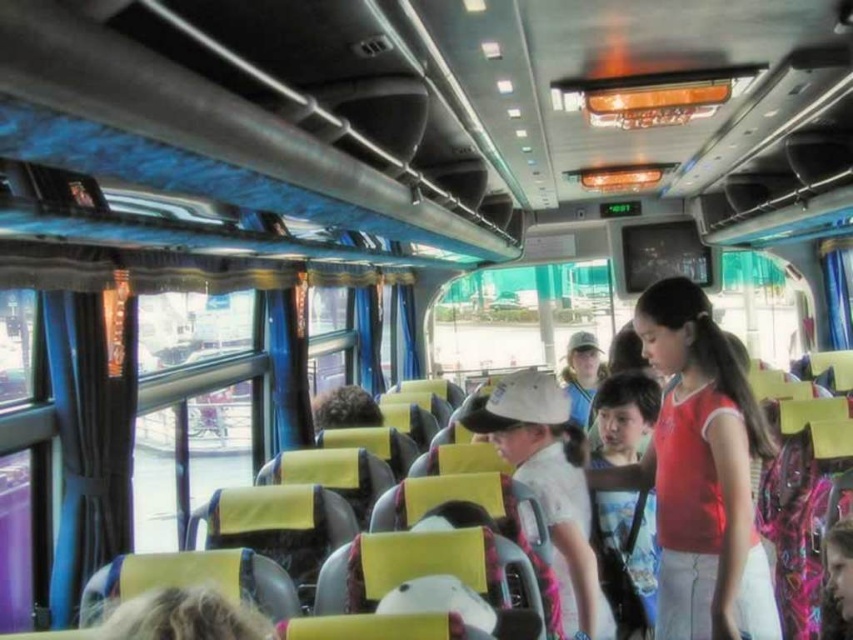
You are a bus passenger who wants to place both the white matte hat at center and the matte white cap at center into a small bag. Which item will fit better in the bag?

The white matte hat at center has a lesser width compared to the matte white cap at center, so it will fit better in the small bag.

You are a parent trying to locate your child in a crowded bus. You see a white matte hat at center and a matte white cap at center. Which object is closer to the front of the bus?

The distance between the white matte hat at center and the matte white cap at center is 8.68 feet, but without additional information about their positions relative to the bus front, I cannot determine which is closer.